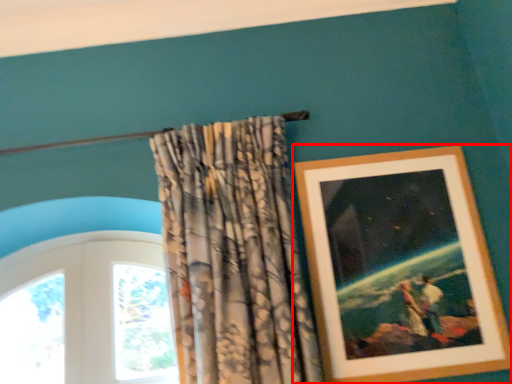
Question: From the image's perspective, what is the correct spatial relationship of picture frame (annotated by the red box) in relation to curtain?

Choices:
 (A) below
 (B) above

Answer: (A)